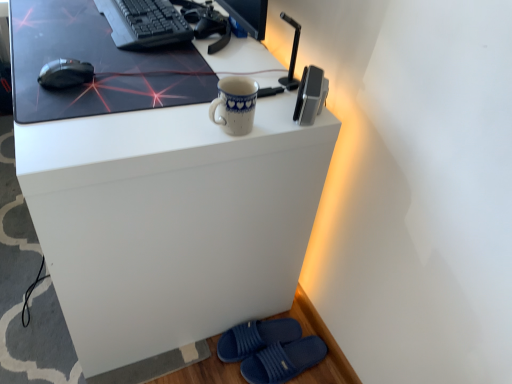
Locate an element on the screen. free space between blue porcelain mug at upper center and satin silver speaker at upper right is located at coordinates (x=274, y=111).